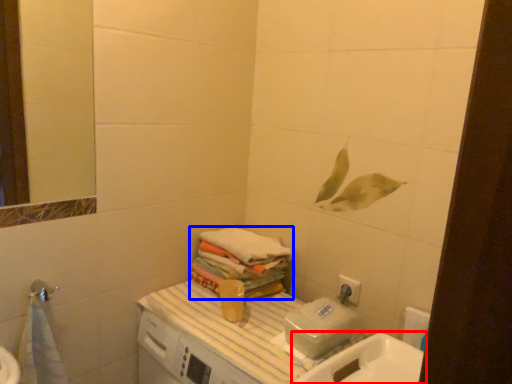
Question: Which object is further to the camera taking this photo, sink (highlighted by a red box) or bath towel (highlighted by a blue box)?

Choices:
 (A) sink
 (B) bath towel

Answer: (B)